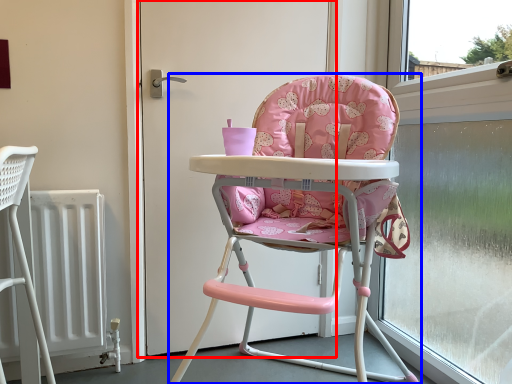
Question: Which of the following is the closest to the observer, screen door (highlighted by a red box) or chair (highlighted by a blue box)?

Choices:
 (A) screen door
 (B) chair

Answer: (B)